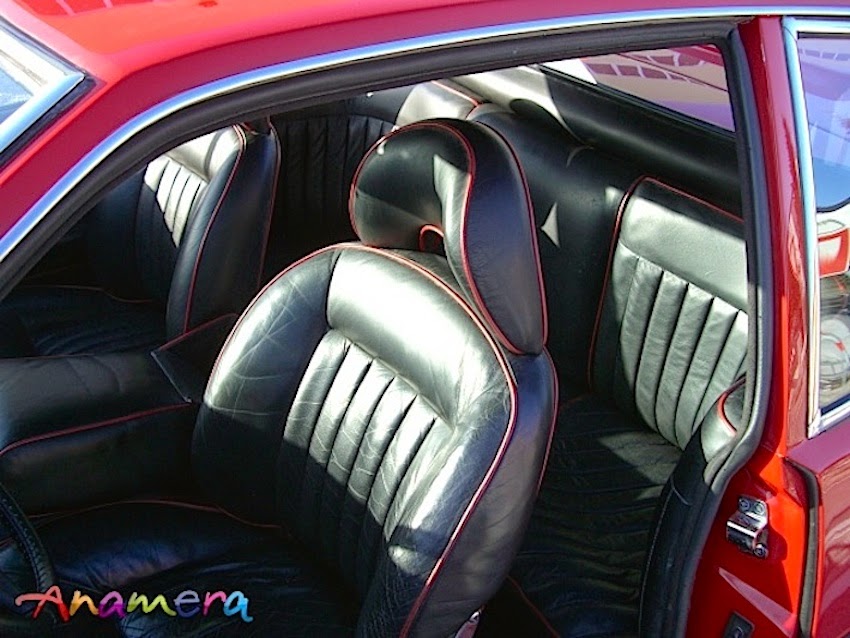
I want to click on seat, so click(x=609, y=469).